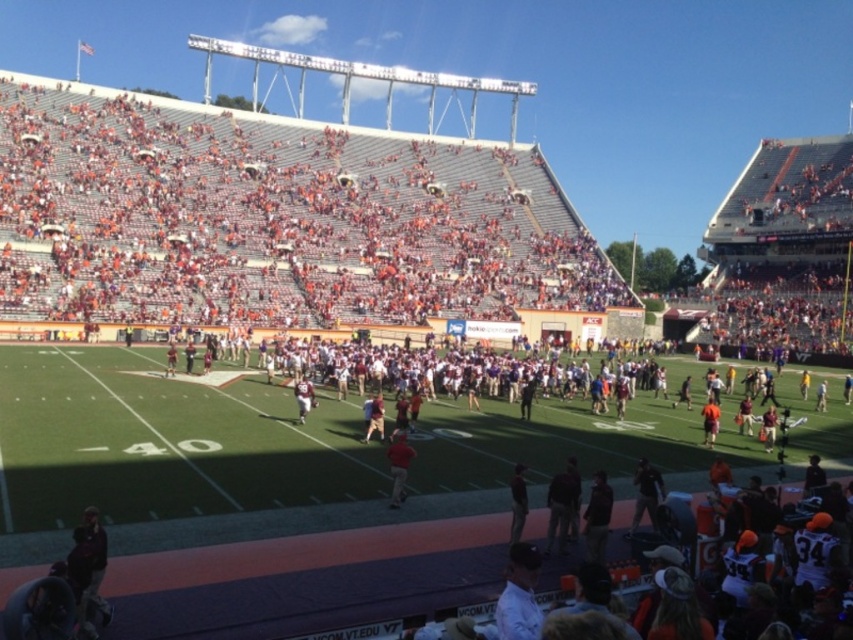
Question: Considering the relative positions of matte red jersey at center and orange fabric person at center in the image provided, where is matte red jersey at center located with respect to orange fabric person at center?

Choices:
 (A) right
 (B) left

Answer: (B)

Question: Estimate the real-world distances between objects in this image. Which object is closer to the red matte shirt at center?

Choices:
 (A) matte red jersey at center
 (B) dark gray uniform at center
 (C) tan fabric pants at center

Answer: (C)

Question: Does red matte shirt at center appear under orange fabric person at center?

Choices:
 (A) yes
 (B) no

Answer: (A)

Question: Which point is closer to the camera?

Choices:
 (A) red matte shirt at center
 (B) dark brown leather jacket at center

Answer: (B)

Question: Which is farther from the orange fabric person at center?

Choices:
 (A) matte red jersey at center
 (B) dark brown leather jacket at center
 (C) tan fabric pants at center

Answer: (B)

Question: Can you confirm if dark brown leather jacket at center is positioned to the right of matte red jersey at center?

Choices:
 (A) yes
 (B) no

Answer: (A)